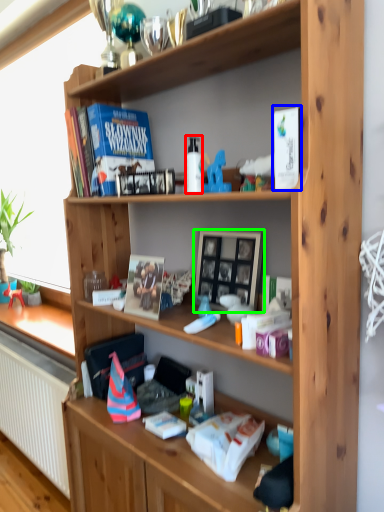
Question: Considering the real-world distances, which object is farthest from bottle (highlighted by a red box)? paperback book (highlighted by a blue box) or picture frame (highlighted by a green box)?

Choices:
 (A) paperback book
 (B) picture frame

Answer: (A)